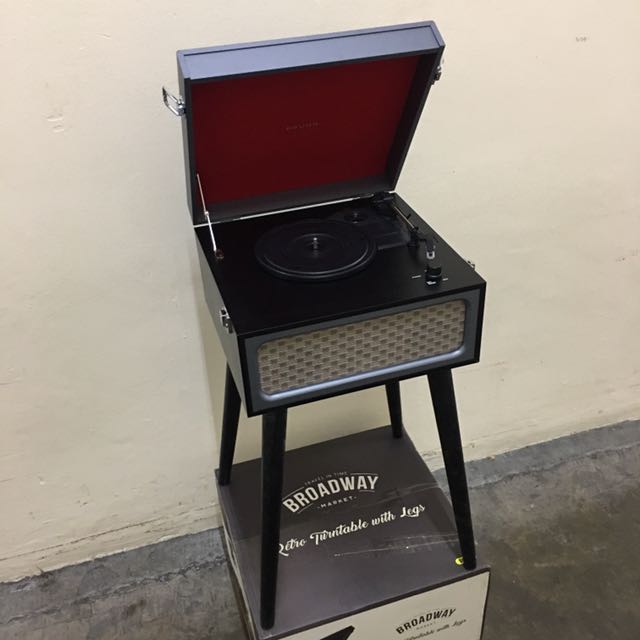
You are a GUI agent. You are given a task and a screenshot of the screen. Output one action in this format:
    pyautogui.click(x=<x>, y=<y>)
    Task: Click on the box
    Image resolution: width=640 pixels, height=640 pixels.
    Given the screenshot: What is the action you would take?
    tap(368, 555)